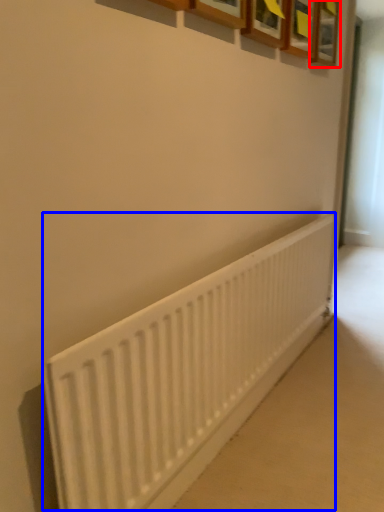
Question: Which of the following is the closest to the observer, picture frame (highlighted by a red box) or radiator (highlighted by a blue box)?

Choices:
 (A) picture frame
 (B) radiator

Answer: (B)